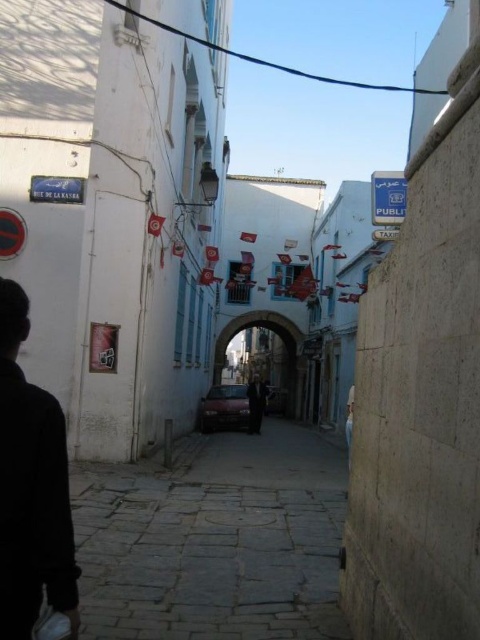
You are driving a matte red car at center and want to park it in a spot that is exactly as wide as the blue plastic sign at upper center. Based on the scene description, will the car fit in the parking spot?

The matte red car at center is thinner than the blue plastic sign at upper center, so the car will fit in the parking spot since it is narrower than the sign.

You are standing at the entrance of the narrow street in front of the historic buildings. There are two points marked in the scene. The first point is at coordinates (315, 548) and the second is at (249, 422). If you want to take a photo that includes both points, which point should you focus on to ensure both are in the frame?

You should focus on point (249, 422) because it is farther from the camera than point (315, 548). By focusing on the farther point, both points will be within the frame.

You are driving a matte red car at center and want to park it near the blue plastic sign at upper center. Considering the spatial relationship between them, can you park the car directly in front of the sign?

The matte red car at center is further to the viewer than the blue plastic sign at upper center, meaning the car is closer to you and the sign is behind it. Therefore, you cannot park the matte red car at center directly in front of the blue plastic sign at upper center because it is already positioned behind the car.